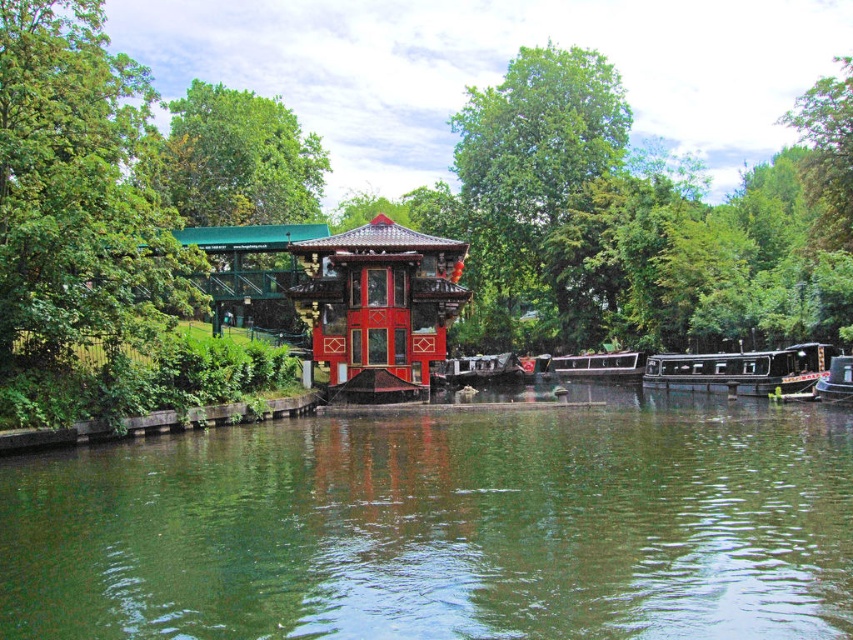
You are a painter standing on the wooden dock and want to paint the green leafy tree at left and the black polished wood barge at lower right. Which object should you move closer to if you want to paint more details of the tree?

You should move closer to the green leafy tree at left because it has a larger size compared to the black polished wood barge at lower right, allowing you to capture more details when closer.

You are a visitor standing on the wooden dock on the left side of the image. You want to take a photo of the shiny red gazebo at center and the green smooth water at center. Which object will appear taller in your photo?

The shiny red gazebo at center will appear taller in the photo because the green smooth water at center is not as tall as the shiny red gazebo at center according to the description.

You are standing on the riverside path and want to take a photo of both the green leafy tree at left and the black polished wood barge at lower right. Which object should you focus on first to ensure both are in frame?

You should focus on the green leafy tree at left first because it is closer to you than the black polished wood barge at lower right, so adjusting the camera to include both would require framing starting from the closer object.